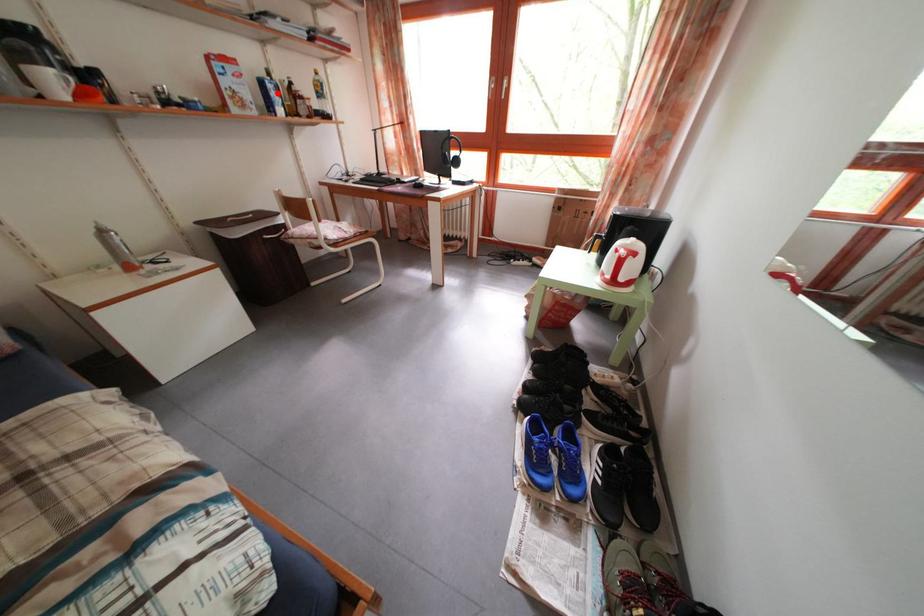
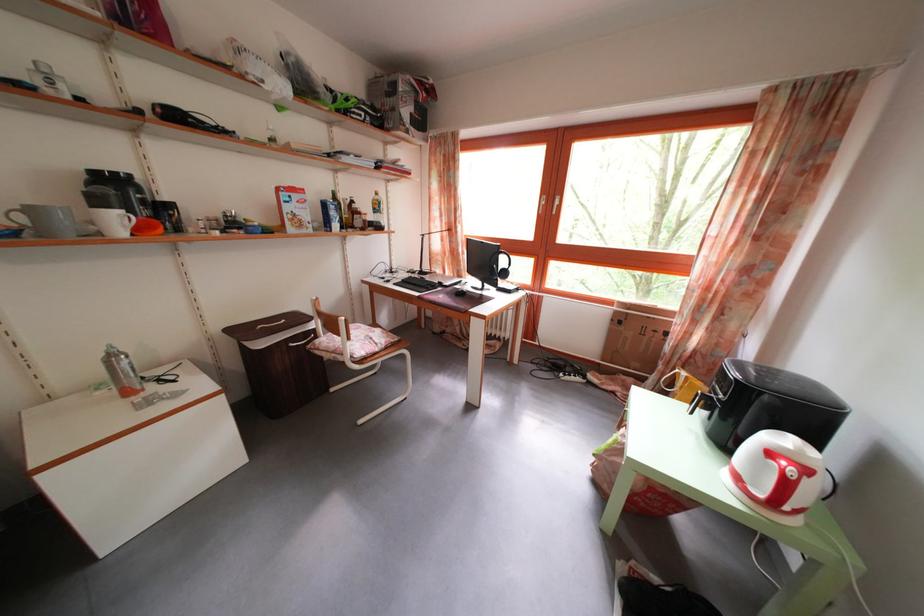
Locate, in the second image, the point that corresponds to the highlighted location in the first image.

(338, 214)